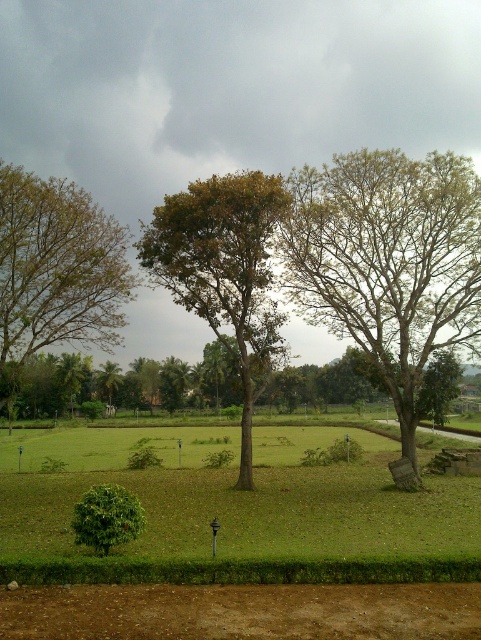
Question: Which point appears farthest from the camera in this image?

Choices:
 (A) (441, 301)
 (B) (257, 212)
 (C) (76, 260)

Answer: (C)

Question: Which object appears closest to the camera in this image?

Choices:
 (A) brown leafy tree at upper left
 (B) green leafy tree at right

Answer: (B)

Question: Considering the real-world distances, which object is closest to the green leafy tree at right?

Choices:
 (A) green leafy tree at center
 (B) brown leafy tree at upper left

Answer: (A)

Question: Can you confirm if green leafy tree at center is thinner than brown leafy tree at upper left?

Choices:
 (A) no
 (B) yes

Answer: (A)

Question: Is green leafy tree at right above green leafy tree at center?

Choices:
 (A) no
 (B) yes

Answer: (A)

Question: Can you confirm if green leafy tree at center is wider than brown leafy tree at upper left?

Choices:
 (A) no
 (B) yes

Answer: (B)